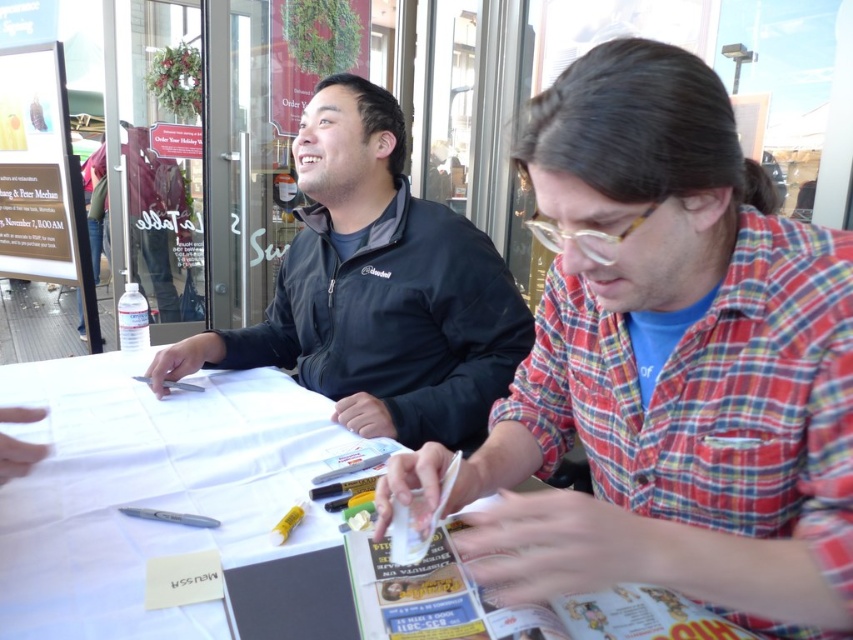
You are a photographer at an event and need to position your camera so that both the black softshell jacket at upper center and the matte white sign at upper left are clearly visible in the frame. Based on their positions, which object should be placed on the right side of the camera frame?

The black softshell jacket at upper center should be placed on the right side of the camera frame because it is positioned to the right of the matte white sign at upper left.

You are a photographer trying to capture a candid shot of the person in the red plaid shirt at the table. You notice a point at coordinates [671,364]. Where is this point located relative to the person in the red plaid shirt?

The point at coordinates [671,364] is located on the plaid shirt at center, which belongs to the person in the red plaid shirt.

You are a photographer at this event and want to capture both the plaid shirt at center and the black softshell jacket at upper center in a single photo. The camera you are using has a maximum focus range that can only accommodate objects within 20 inches of each other. Will you be able to include both subjects in the photo without needing to adjust your position?

The plaid shirt at center and black softshell jacket at upper center are 21.35 inches apart, which exceeds the camera maximum focus range of 20 inches. Therefore, you will need to adjust your position to ensure both subjects are within the 20 inch range.